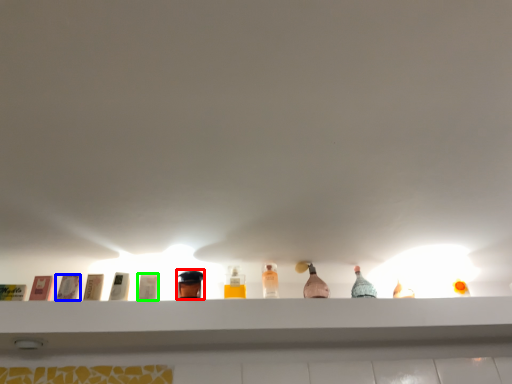
Question: Considering the real-world distances, which object is closest to toiletry (highlighted by a red box)? toiletry (highlighted by a blue box) or toiletry (highlighted by a green box).

Choices:
 (A) toiletry
 (B) toiletry

Answer: (B)